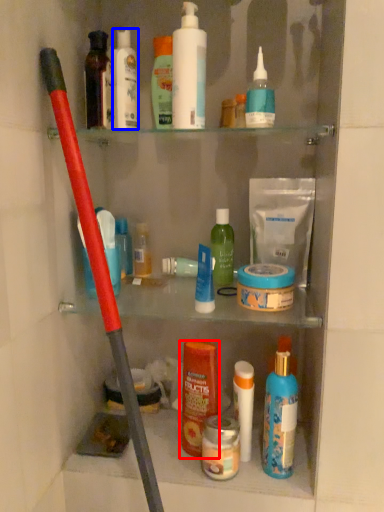
Question: Among these objects, which one is farthest to the camera, toiletry (highlighted by a red box) or toiletry (highlighted by a blue box)?

Choices:
 (A) toiletry
 (B) toiletry

Answer: (B)